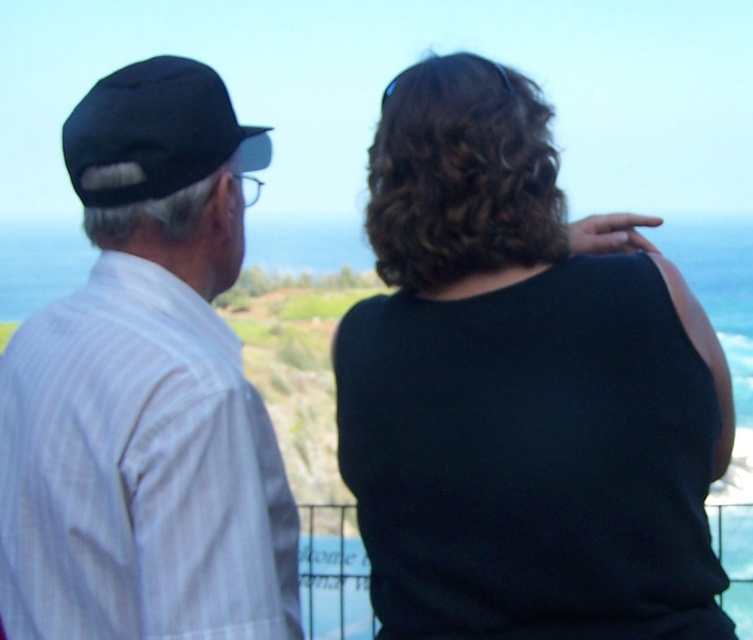
Question: Which point appears closest to the camera in this image?

Choices:
 (A) (166, 65)
 (B) (377, 257)
 (C) (736, 525)
 (D) (87, 323)

Answer: (D)

Question: Which point is closer to the camera taking this photo?

Choices:
 (A) click(x=337, y=557)
 (B) click(x=474, y=422)
 (C) click(x=110, y=90)

Answer: (B)

Question: Which point is farther from the camera taking this photo?

Choices:
 (A) (383, 541)
 (B) (742, 582)
 (C) (191, 534)

Answer: (B)

Question: Is black matte shirt at upper right below blue water at upper center?

Choices:
 (A) no
 (B) yes

Answer: (B)

Question: Considering the relative positions of black matte shirt at upper right and blue water at upper center in the image provided, where is black matte shirt at upper right located with respect to blue water at upper center?

Choices:
 (A) above
 (B) below

Answer: (B)

Question: Can you confirm if black matte shirt at upper right is positioned above blue water at upper center?

Choices:
 (A) yes
 (B) no

Answer: (B)